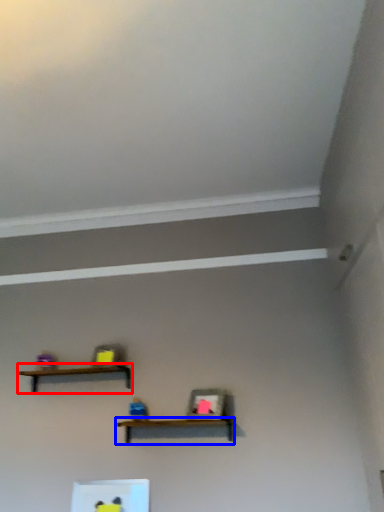
Question: Which object is closer to the camera taking this photo, shelf (highlighted by a red box) or shelf (highlighted by a blue box)?

Choices:
 (A) shelf
 (B) shelf

Answer: (B)